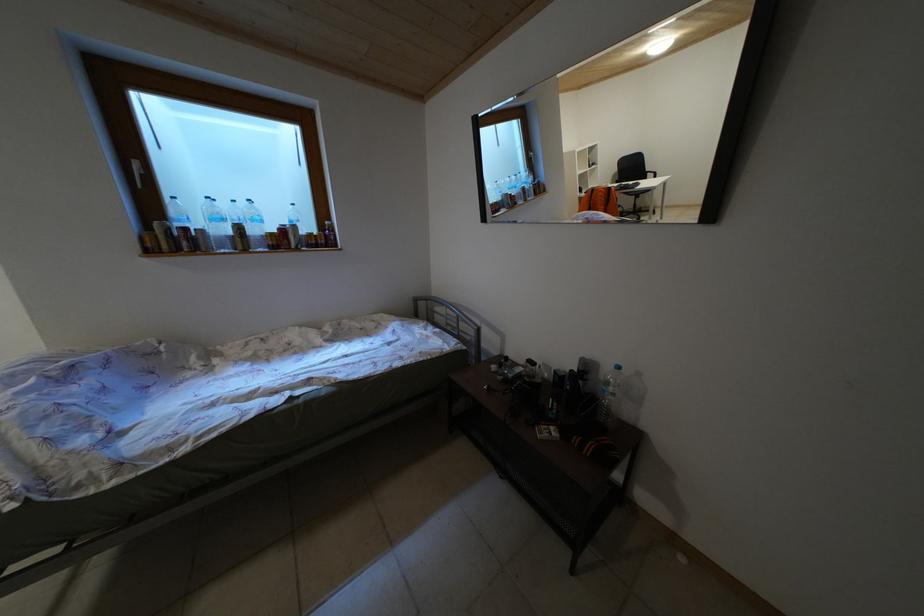
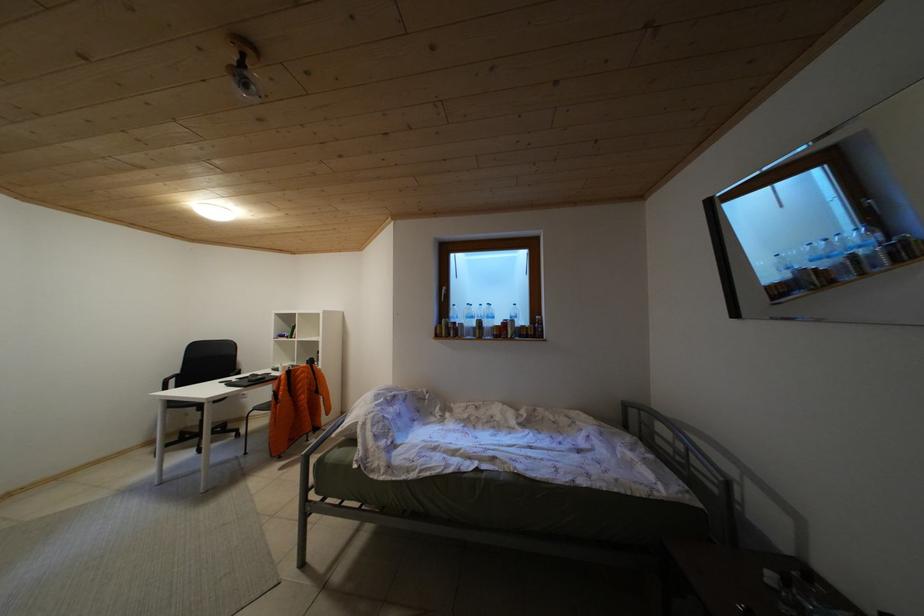
Question: The images are taken continuously from a first-person perspective. In which direction is your viewpoint rotating?

Choices:
 (A) Left
 (B) Right
 (C) Up
 (D) Down

Answer: (A)